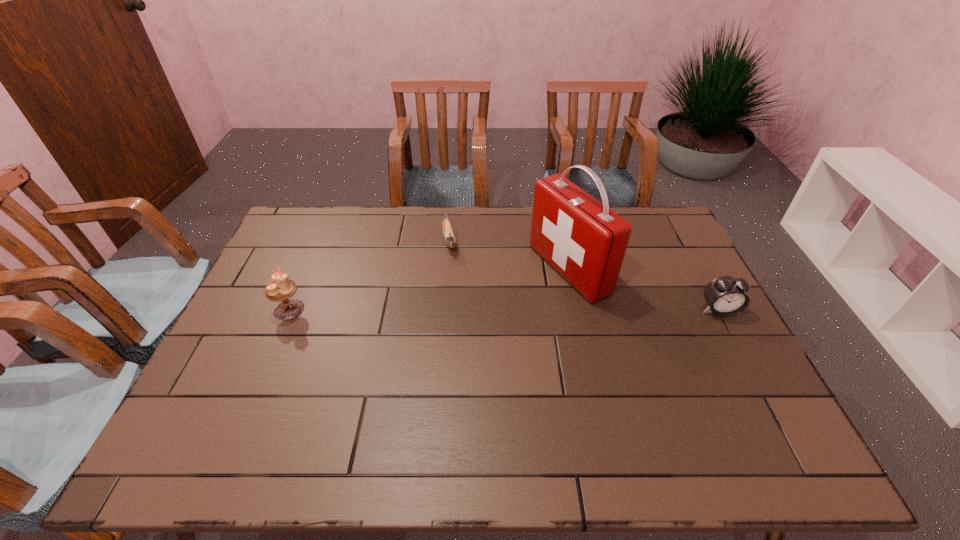
Find the location of `free space between the leftmost object and the rightmost object`. free space between the leftmost object and the rightmost object is located at coordinates (504, 310).

Where is `vacant area that lies between the third shortest object and the second object from right to left`? This screenshot has height=540, width=960. vacant area that lies between the third shortest object and the second object from right to left is located at coordinates (429, 289).

Find the location of a particular element. The height and width of the screenshot is (540, 960). vacant space in between the tallest object and the candle holder is located at coordinates (429, 289).

Choose which object is the nearest neighbor to the rightmost object. Please provide its 2D coordinates. Your answer should be formatted as a tuple, i.e. [(x, y)], where the tuple contains the x and y coordinates of a point satisfying the conditions above.

[(582, 239)]

This screenshot has width=960, height=540. I want to click on object that is the third closest to the shortest object, so click(726, 296).

Image resolution: width=960 pixels, height=540 pixels. In order to click on vacant point that satisfies the following two spatial constraints: 1. on the back side of the leftmost object; 2. on the right side of the tallest object in this screenshot , I will do `click(306, 269)`.